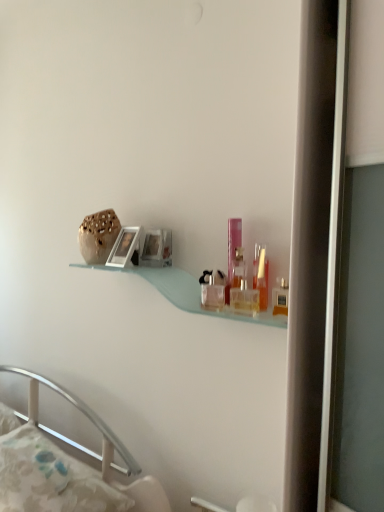
Image resolution: width=384 pixels, height=512 pixels. What do you see at coordinates (233, 252) in the screenshot?
I see `pink plastic perfume at center, the 1th toiletry when ordered from back to front` at bounding box center [233, 252].

Locate an element on the screen. This screenshot has height=512, width=384. white glossy picture frame at upper center is located at coordinates (125, 248).

What do you see at coordinates (280, 297) in the screenshot?
I see `matte plastic toiletry at right, the 1th toiletry when ordered from front to back` at bounding box center [280, 297].

Locate an element on the screen. translucent glass perfume bottle at upper right, which is the second toiletry from right to left is located at coordinates (261, 274).

What do you see at coordinates (261, 274) in the screenshot? This screenshot has width=384, height=512. I see `translucent glass perfume bottle at upper right, which is the second toiletry from right to left` at bounding box center [261, 274].

The width and height of the screenshot is (384, 512). What are the coordinates of `white fabric pillow at lower left` in the screenshot? It's located at (50, 478).

Is translucent glass perfume bottle at upper right, which is the 3th toiletry in back-to-front order, inside the boundaries of matte plastic toiletry at right, placed as the 4th toiletry when sorted from left to right, or outside?

translucent glass perfume bottle at upper right, which is the 3th toiletry in back-to-front order, is spatially situated outside matte plastic toiletry at right, placed as the 4th toiletry when sorted from left to right.

Is point (260, 251) farther from viewer compared to point (277, 285)?

Yes, it is.

From the image's perspective, would you say translucent glass perfume bottle at upper right, which appears as the third toiletry when viewed from the left, is shown under matte plastic toiletry at right, arranged as the 4th toiletry when viewed from the back?

Actually, translucent glass perfume bottle at upper right, which appears as the third toiletry when viewed from the left, appears above matte plastic toiletry at right, arranged as the 4th toiletry when viewed from the back, in the image.

How different are the orientations of translucent glass perfume bottle at upper right, which appears as the third toiletry when viewed from the left, and matte plastic toiletry at right, arranged as the 4th toiletry when viewed from the back, in degrees?

The angle between the facing direction of translucent glass perfume bottle at upper right, which appears as the third toiletry when viewed from the left, and the facing direction of matte plastic toiletry at right, arranged as the 4th toiletry when viewed from the back, is 3.26 degrees.

Which object is wider, white fabric pillow at lower left or translucent glass perfume bottle at upper right, which is the second toiletry from right to left?

Wider between the two is white fabric pillow at lower left.

From the image's perspective, which object appears higher, white fabric pillow at lower left or translucent glass perfume bottle at upper right, which appears as the third toiletry when viewed from the left?

translucent glass perfume bottle at upper right, which appears as the third toiletry when viewed from the left, from the image's perspective.

Considering the sizes of objects white fabric pillow at lower left and translucent glass perfume bottle at upper right, which is the 3th toiletry in back-to-front order, in the image provided, who is bigger, white fabric pillow at lower left or translucent glass perfume bottle at upper right, which is the 3th toiletry in back-to-front order,?

white fabric pillow at lower left.

Considering their positions, is white fabric pillow at lower left located in front of or behind translucent glass perfume bottle at upper right, marked as the second toiletry in a front-to-back arrangement?

Clearly, white fabric pillow at lower left is in front of translucent glass perfume bottle at upper right, marked as the second toiletry in a front-to-back arrangement.

Which is behind, point (210, 304) or point (42, 506)?

The point (210, 304) is farther from the camera.

Considering the relative sizes of clear glass perfume bottles at center, which is the first toiletry in left-to-right order, and white fabric pillow at lower left in the image provided, is clear glass perfume bottles at center, which is the first toiletry in left-to-right order, thinner than white fabric pillow at lower left?

Correct, the width of clear glass perfume bottles at center, which is the first toiletry in left-to-right order, is less than that of white fabric pillow at lower left.

Which is correct: clear glass perfume bottles at center, marked as the fourth toiletry in a right-to-left arrangement, is inside white fabric pillow at lower left, or outside of it?

clear glass perfume bottles at center, marked as the fourth toiletry in a right-to-left arrangement, is outside white fabric pillow at lower left.

From the image's perspective, is clear glass perfume bottles at center, which appears as the second toiletry when viewed from the back, on top of white fabric pillow at lower left?

Yes.

Are white glossy picture frame at upper center and white fabric pillow at lower left located far from each other?

No.

Considering the points (121, 255) and (19, 471), which point is behind, point (121, 255) or point (19, 471)?

Positioned behind is point (121, 255).

Based on the photo, does white glossy picture frame at upper center have a lesser width compared to white fabric pillow at lower left?

Yes.

Locate an element on the screen. pillow below the white glossy picture frame at upper center (from the image's perspective) is located at coordinates (50, 478).

Considering the relative sizes of translucent glass perfume bottle at upper right, marked as the second toiletry in a front-to-back arrangement, and white fabric pillow at lower left in the image provided, is translucent glass perfume bottle at upper right, marked as the second toiletry in a front-to-back arrangement, wider than white fabric pillow at lower left?

Incorrect, the width of translucent glass perfume bottle at upper right, marked as the second toiletry in a front-to-back arrangement, does not surpass that of white fabric pillow at lower left.

Is translucent glass perfume bottle at upper right, which is the second toiletry from right to left, oriented towards white fabric pillow at lower left?

No, translucent glass perfume bottle at upper right, which is the second toiletry from right to left, is not aimed at white fabric pillow at lower left.

From the image's perspective, is translucent glass perfume bottle at upper right, which is the second toiletry from right to left, located above or below white fabric pillow at lower left?

From the image's perspective, translucent glass perfume bottle at upper right, which is the second toiletry from right to left, appears above white fabric pillow at lower left.

Which object is positioned more to the left, translucent glass perfume bottle at upper right, which is the second toiletry from right to left, or white fabric pillow at lower left?

Positioned to the left is white fabric pillow at lower left.

Considering the relative sizes of translucent glass perfume bottle at upper right, marked as the second toiletry in a front-to-back arrangement, and clear glass perfume bottles at center, marked as the fourth toiletry in a right-to-left arrangement, in the image provided, is translucent glass perfume bottle at upper right, marked as the second toiletry in a front-to-back arrangement, thinner than clear glass perfume bottles at center, marked as the fourth toiletry in a right-to-left arrangement,?

Correct, the width of translucent glass perfume bottle at upper right, marked as the second toiletry in a front-to-back arrangement, is less than that of clear glass perfume bottles at center, marked as the fourth toiletry in a right-to-left arrangement.

Considering the relative sizes of translucent glass perfume bottle at upper right, which is the 3th toiletry in back-to-front order, and clear glass perfume bottles at center, marked as the fourth toiletry in a right-to-left arrangement, in the image provided, is translucent glass perfume bottle at upper right, which is the 3th toiletry in back-to-front order, taller than clear glass perfume bottles at center, marked as the fourth toiletry in a right-to-left arrangement,?

Yes, translucent glass perfume bottle at upper right, which is the 3th toiletry in back-to-front order, is taller than clear glass perfume bottles at center, marked as the fourth toiletry in a right-to-left arrangement.

Is translucent glass perfume bottle at upper right, which is the 3th toiletry in back-to-front order, situated inside clear glass perfume bottles at center, which is the first toiletry in left-to-right order, or outside?

translucent glass perfume bottle at upper right, which is the 3th toiletry in back-to-front order, is outside clear glass perfume bottles at center, which is the first toiletry in left-to-right order.

Which is farther from the camera, [256,254] or [214,304]?

Point [256,254]

In terms of height, does matte plastic toiletry at right, arranged as the 4th toiletry when viewed from the back, look taller or shorter compared to white fabric pillow at lower left?

Considering their sizes, matte plastic toiletry at right, arranged as the 4th toiletry when viewed from the back, has less height than white fabric pillow at lower left.

Does point (280, 298) appear closer or farther from the camera than point (36, 463)?

Point (280, 298) is closer to the camera than point (36, 463).

From a real-world perspective, is matte plastic toiletry at right, arranged as the 4th toiletry when viewed from the back, above or below white fabric pillow at lower left?

matte plastic toiletry at right, arranged as the 4th toiletry when viewed from the back, is above white fabric pillow at lower left.

From the image's perspective, is matte plastic toiletry at right, arranged as the 4th toiletry when viewed from the back, above white fabric pillow at lower left?

Yes, from the image's perspective, matte plastic toiletry at right, arranged as the 4th toiletry when viewed from the back, is on top of white fabric pillow at lower left.

Locate an element on the screen. toiletry on the right of translucent glass perfume bottle at upper right, which is the 3th toiletry in back-to-front order is located at coordinates (280, 297).

The height and width of the screenshot is (512, 384). What are the coordinates of `pillow on the left of translucent glass perfume bottle at upper right, which is the second toiletry from right to left` in the screenshot? It's located at (50, 478).

Looking at the image, which one is located further to clear glass perfume bottles at center, which is the first toiletry in left-to-right order, white fabric pillow at lower left or pink plastic perfume at center, the third toiletry positioned from the right?

white fabric pillow at lower left.

Looking at the image, which one is located closer to translucent glass perfume bottle at upper right, which appears as the third toiletry when viewed from the left, white fabric pillow at lower left or matte plastic toiletry at right, placed as the 4th toiletry when sorted from left to right?

matte plastic toiletry at right, placed as the 4th toiletry when sorted from left to right, is closer to translucent glass perfume bottle at upper right, which appears as the third toiletry when viewed from the left.

Estimate the real-world distances between objects in this image. Which object is closer to translucent glass perfume bottle at upper right, which is the second toiletry from right to left, pink plastic perfume at center, which is counted as the second toiletry, starting from the left, or white fabric pillow at lower left?

pink plastic perfume at center, which is counted as the second toiletry, starting from the left, lies closer to translucent glass perfume bottle at upper right, which is the second toiletry from right to left, than the other object.

When comparing their distances from translucent glass perfume bottle at upper right, which appears as the third toiletry when viewed from the left, does white fabric pillow at lower left or clear glass perfume bottles at center, which is the first toiletry in left-to-right order, seem closer?

Based on the image, clear glass perfume bottles at center, which is the first toiletry in left-to-right order, appears to be nearer to translucent glass perfume bottle at upper right, which appears as the third toiletry when viewed from the left.

Looking at the image, which one is located further to clear glass perfume bottles at center, marked as the fourth toiletry in a right-to-left arrangement, pink plastic perfume at center, the 1th toiletry when ordered from back to front, or white fabric pillow at lower left?

white fabric pillow at lower left is positioned further to the anchor clear glass perfume bottles at center, marked as the fourth toiletry in a right-to-left arrangement.

Looking at the image, which one is located closer to clear glass perfume bottles at center, which is the first toiletry in left-to-right order, translucent glass perfume bottle at upper right, which is the 3th toiletry in back-to-front order, or white glossy picture frame at upper center?

translucent glass perfume bottle at upper right, which is the 3th toiletry in back-to-front order, lies closer to clear glass perfume bottles at center, which is the first toiletry in left-to-right order, than the other object.

Estimate the real-world distances between objects in this image. Which object is further from white glossy picture frame at upper center, translucent glass perfume bottle at upper right, which appears as the third toiletry when viewed from the left, or matte plastic toiletry at right, the 1th toiletry when ordered from front to back?

matte plastic toiletry at right, the 1th toiletry when ordered from front to back, lies further to white glossy picture frame at upper center than the other object.

From the image, which object appears to be nearer to matte plastic toiletry at right, the 1th toiletry when ordered from front to back, clear glass perfume bottles at center, marked as the fourth toiletry in a right-to-left arrangement, or white fabric pillow at lower left?

The object closer to matte plastic toiletry at right, the 1th toiletry when ordered from front to back, is clear glass perfume bottles at center, marked as the fourth toiletry in a right-to-left arrangement.

The width and height of the screenshot is (384, 512). Find the location of `toiletry between clear glass perfume bottles at center, arranged as the third toiletry when viewed from the front, and translucent glass perfume bottle at upper right, which is the 3th toiletry in back-to-front order`. toiletry between clear glass perfume bottles at center, arranged as the third toiletry when viewed from the front, and translucent glass perfume bottle at upper right, which is the 3th toiletry in back-to-front order is located at coordinates (233, 252).

In order to click on toiletry located between white glossy picture frame at upper center and pink plastic perfume at center, which is counted as the fourth toiletry, starting from the front, in the left-right direction in this screenshot , I will do (x=213, y=290).